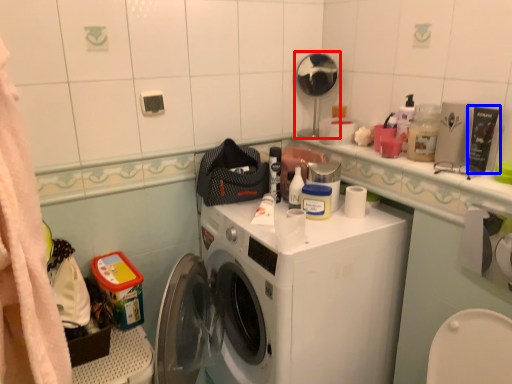
Question: Which of the following is the closest to the observer, shower (highlighted by a red box) or toiletry (highlighted by a blue box)?

Choices:
 (A) shower
 (B) toiletry

Answer: (B)